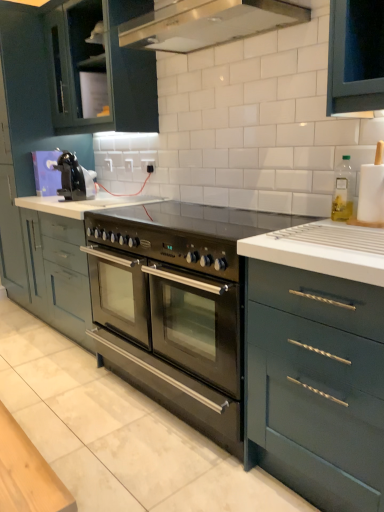
Identify the location of vacant region under matte black coffee maker at left (from a real-world perspective). Image resolution: width=384 pixels, height=512 pixels. (75, 198).